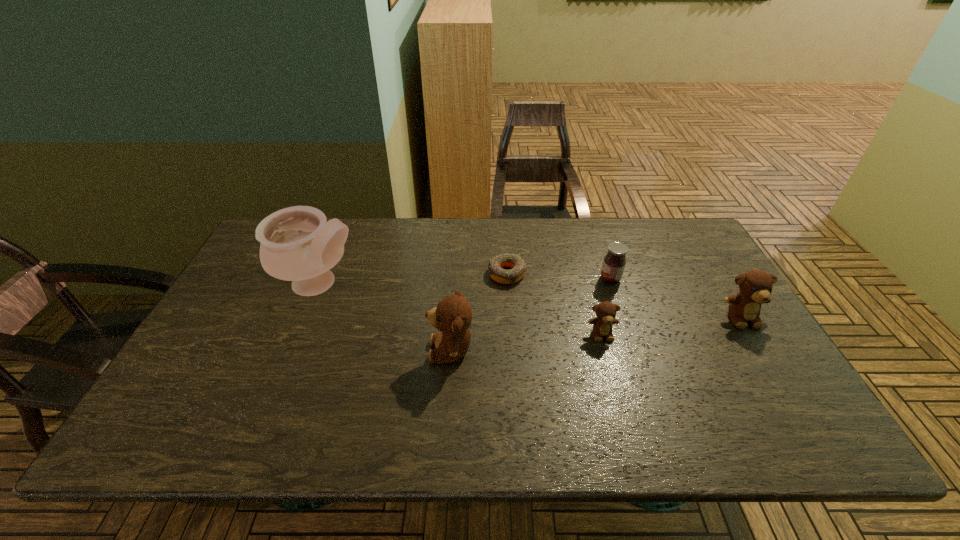
The height and width of the screenshot is (540, 960). Identify the location of vacant space located 0.350m on the face of the leftmost teddy bear. (291, 350).

This screenshot has width=960, height=540. Identify the location of free space located 0.090m on the face of the leftmost teddy bear. (394, 350).

Where is `free space located on the face of the leftmost teddy bear`? Image resolution: width=960 pixels, height=540 pixels. free space located on the face of the leftmost teddy bear is located at coordinates (362, 350).

The width and height of the screenshot is (960, 540). Find the location of `vacant position located on the face of the second shortest object`. vacant position located on the face of the second shortest object is located at coordinates (621, 403).

Where is `vacant region located on the face of the fourth shortest object`? vacant region located on the face of the fourth shortest object is located at coordinates (758, 345).

You are a GUI agent. You are given a task and a screenshot of the screen. Output one action in this format:
    pyautogui.click(x=<x>, y=<y>)
    Task: Click on the free space located 0.400m on the right of the pottery
    The width and height of the screenshot is (960, 540).
    Given the screenshot: What is the action you would take?
    pyautogui.click(x=500, y=284)

Image resolution: width=960 pixels, height=540 pixels. I want to click on free space located 0.350m on the left of the doughnut, so click(x=373, y=274).

Where is `vacant space located 0.340m on the label side of the jam`? vacant space located 0.340m on the label side of the jam is located at coordinates tap(487, 279).

Where is `free space located on the label side of the jam`? free space located on the label side of the jam is located at coordinates (530, 279).

Image resolution: width=960 pixels, height=540 pixels. Find the location of `vacant area located on the label side of the jam`. vacant area located on the label side of the jam is located at coordinates (497, 279).